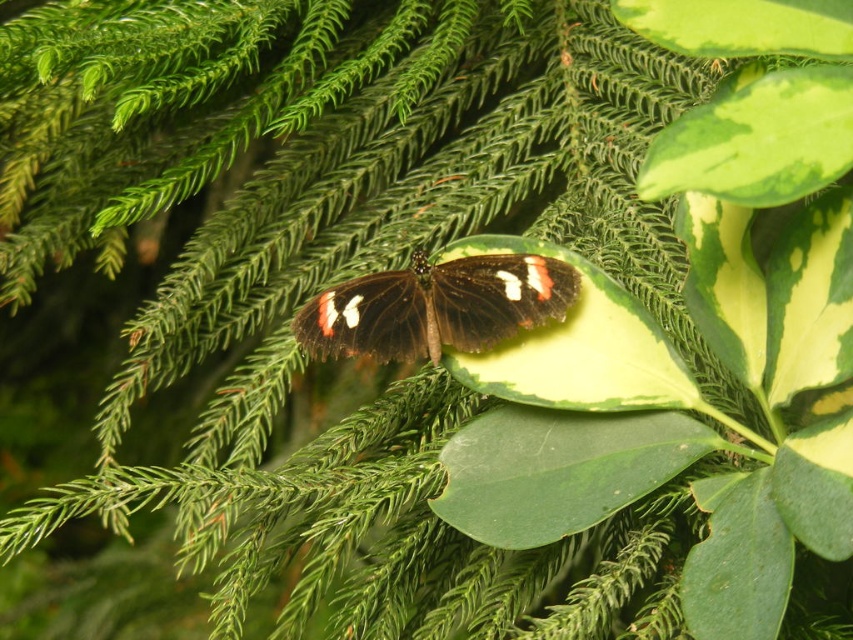
Question: Which of these objects is positioned closest to the black glossy butterfly at center?

Choices:
 (A) green glossy leaf at upper right
 (B) green glossy leaf at center

Answer: (B)

Question: Estimate the real-world distances between objects in this image. Which object is farther from the black glossy butterfly at center?

Choices:
 (A) green glossy leaf at upper right
 (B) green glossy leaf at center

Answer: (A)

Question: Is black glossy butterfly at center smaller than green glossy leaf at upper right?

Choices:
 (A) yes
 (B) no

Answer: (A)

Question: Which object is the farthest from the green glossy leaf at center?

Choices:
 (A) green glossy leaf at upper right
 (B) black glossy butterfly at center

Answer: (A)

Question: Is green glossy leaf at center below green glossy leaf at upper right?

Choices:
 (A) yes
 (B) no

Answer: (A)

Question: Is black glossy butterfly at center to the left of green glossy leaf at upper right from the viewer's perspective?

Choices:
 (A) no
 (B) yes

Answer: (B)